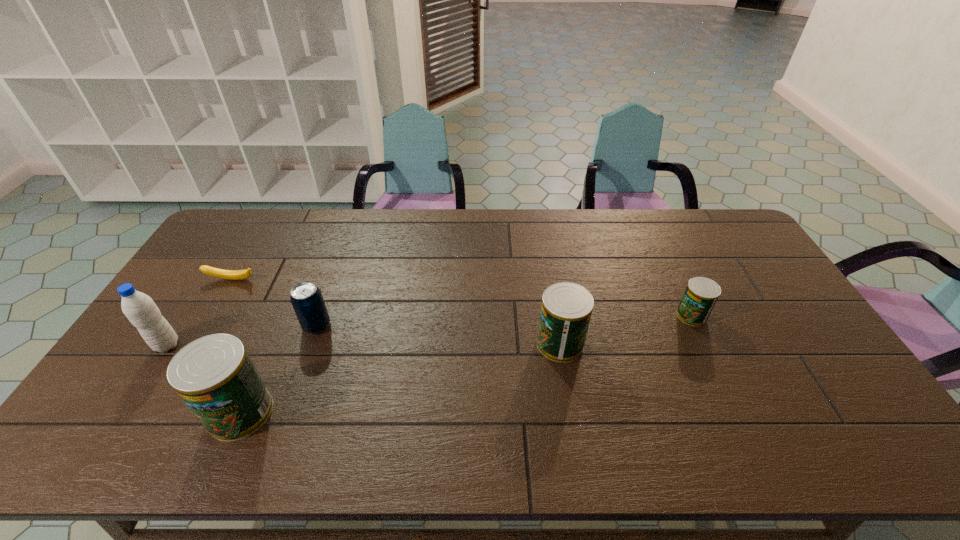
Find the location of a particular element. blank area in the image that satisfies the following two spatial constraints: 1. on the back side of the third tallest object; 2. on the left side of the water bottle is located at coordinates (168, 344).

Find the location of a particular element. This screenshot has width=960, height=540. vacant space that satisfies the following two spatial constraints: 1. on the back side of the third shortest object; 2. on the right side of the water bottle is located at coordinates (180, 326).

Where is `free region that satisfies the following two spatial constraints: 1. at the stem of the shortest object; 2. on the left side of the nearest can`? The height and width of the screenshot is (540, 960). free region that satisfies the following two spatial constraints: 1. at the stem of the shortest object; 2. on the left side of the nearest can is located at coordinates (154, 412).

Locate an element on the screen. The height and width of the screenshot is (540, 960). free spot that satisfies the following two spatial constraints: 1. at the stem of the farthest object; 2. on the left side of the fifth tallest object is located at coordinates (211, 315).

This screenshot has width=960, height=540. What are the coordinates of `blank space that satisfies the following two spatial constraints: 1. on the back side of the rightmost can; 2. on the left side of the water bottle` in the screenshot? It's located at (186, 315).

Find the location of a particular element. Image resolution: width=960 pixels, height=540 pixels. vacant space that satisfies the following two spatial constraints: 1. on the back side of the second shortest object; 2. on the right side of the soda can is located at coordinates (321, 315).

This screenshot has height=540, width=960. What are the coordinates of `free space that satisfies the following two spatial constraints: 1. at the stem of the shortest object; 2. on the right side of the fourth tallest object` in the screenshot? It's located at (204, 326).